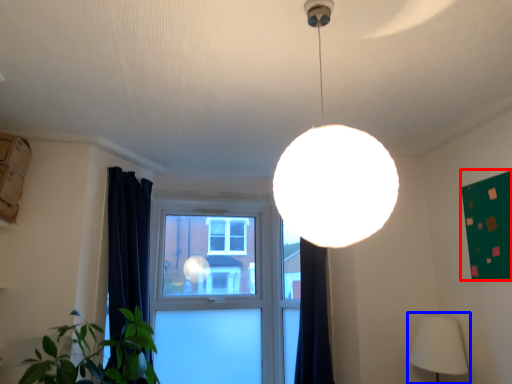
Question: Which of the following is the closest to the observer, bulletin board (highlighted by a red box) or lamp (highlighted by a blue box)?

Choices:
 (A) bulletin board
 (B) lamp

Answer: (A)